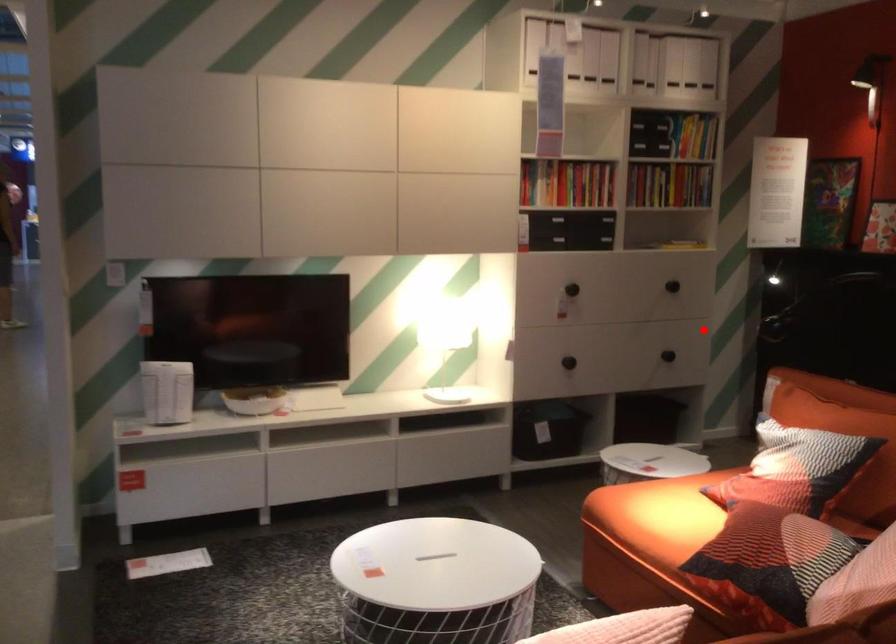
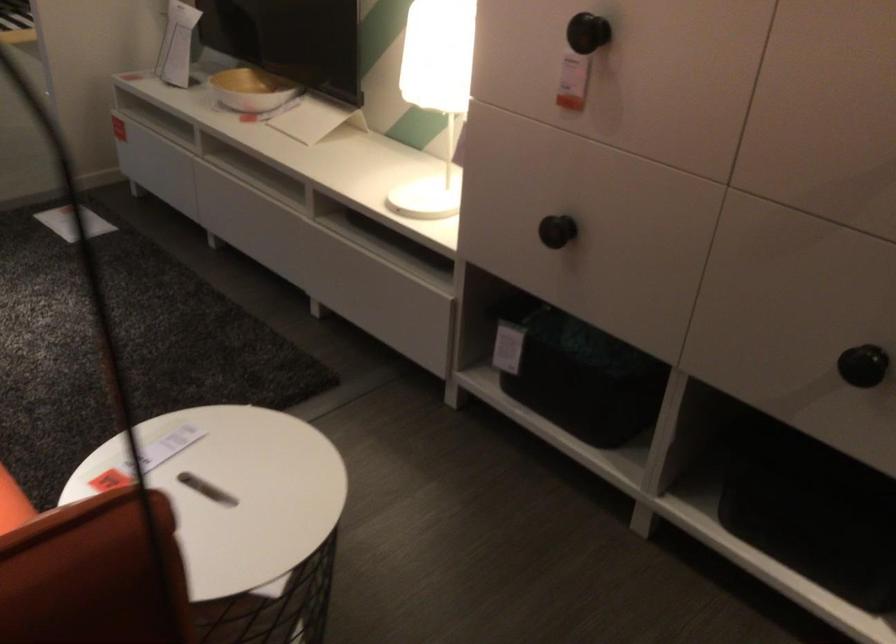
Question: I am providing you with two images of the same scene from different viewpoints. Given a red point in image1, look at the same physical point in image2. Is it:

Choices:
 (A) Closer to the viewpoint
 (B) Farther from the viewpoint

Answer: (A)